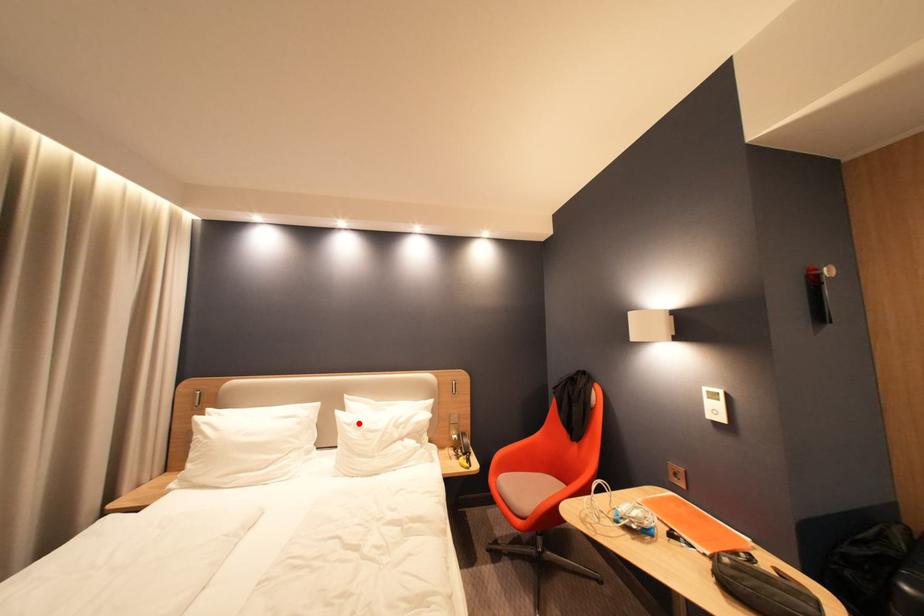
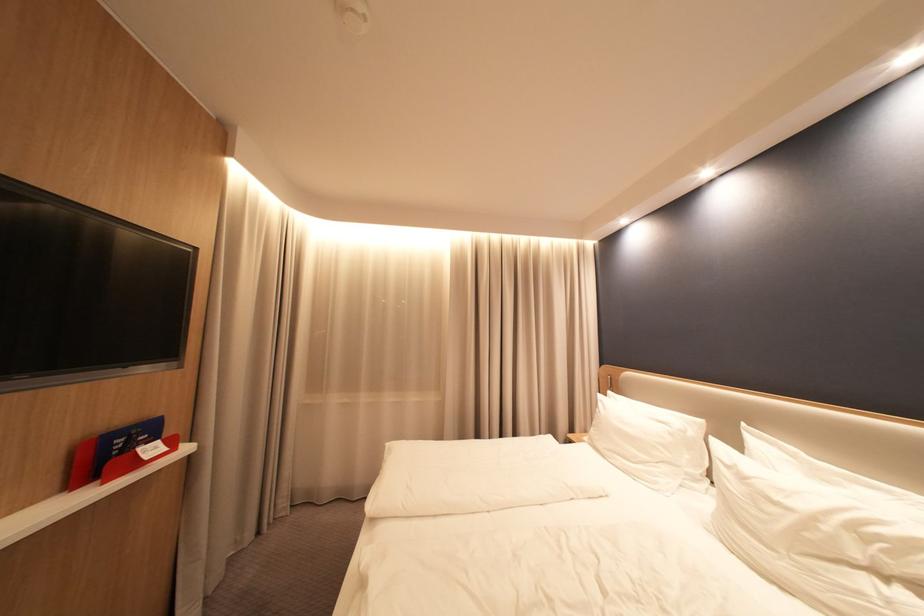
Where in the second image is the point corresponding to the highlighted location from the first image?

(737, 464)